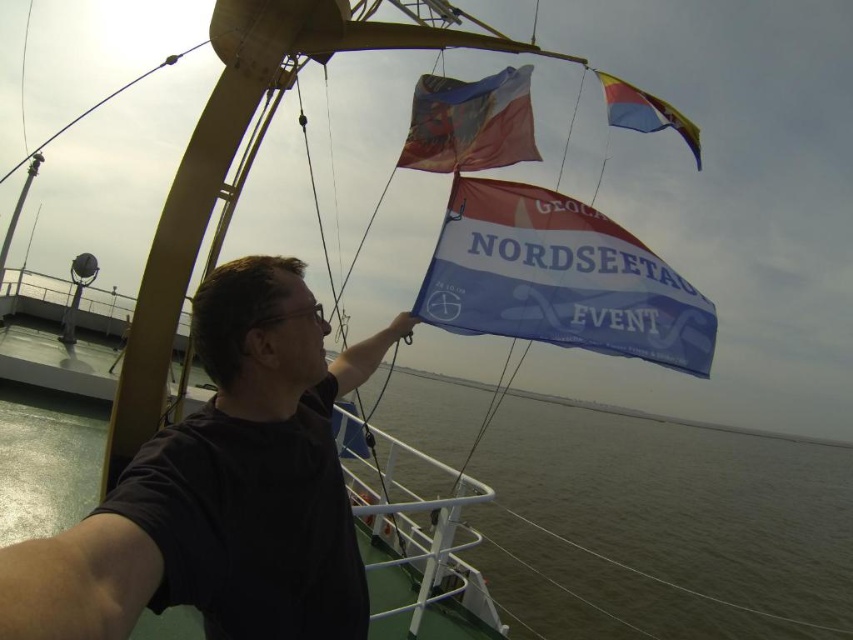
Question: Can you confirm if black matte shirt at center is thinner than multicolored fabric flag at upper center?

Choices:
 (A) yes
 (B) no

Answer: (A)

Question: In this image, where is multicolored fabric flag at upper center located relative to polyester flag at upper right?

Choices:
 (A) above
 (B) below

Answer: (A)

Question: Does blue fabric flag at center have a smaller size compared to polyester flag at upper right?

Choices:
 (A) yes
 (B) no

Answer: (B)

Question: Which object is the closest to the multicolored fabric flag at upper center?

Choices:
 (A) blue fabric flag at center
 (B) black matte shirt at center

Answer: (A)

Question: Which object is farther from the camera taking this photo?

Choices:
 (A) polyester flag at upper right
 (B) blue fabric flag at center
 (C) black matte shirt at center

Answer: (A)

Question: Among these points, which one is nearest to the camera?

Choices:
 (A) (248, 540)
 (B) (505, 81)

Answer: (A)